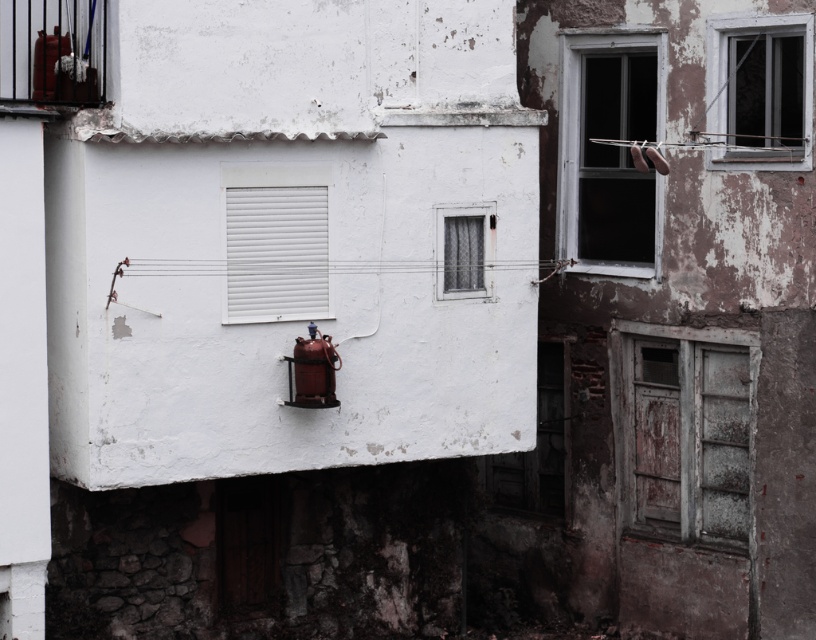
You are standing 10 meters away from a building. You see a point marked at coordinates point (502, 262). Can you reach that point without moving closer than your current position?

The distance of point (502, 262) from viewer is 14.05 meters. Since you are currently 10 meters away, you need to move 4.05 meters closer to reach it, which means you have to move closer than your current position to reach the point.

You are a painter assessing the building for repairs. You notice the clear glass window at upper right and the metallic wire at center. Which object requires more attention in terms of size when planning to replace them? Explain your reasoning based on their sizes.

The clear glass window at upper right requires more attention because it is bigger than the metallic wire at center, so replacing it may need more material and careful planning due to its larger size.